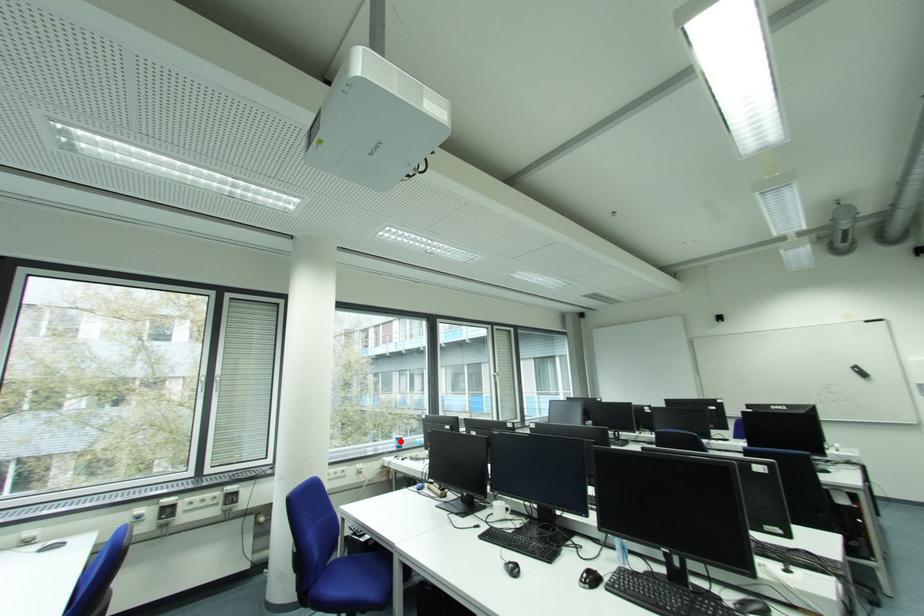
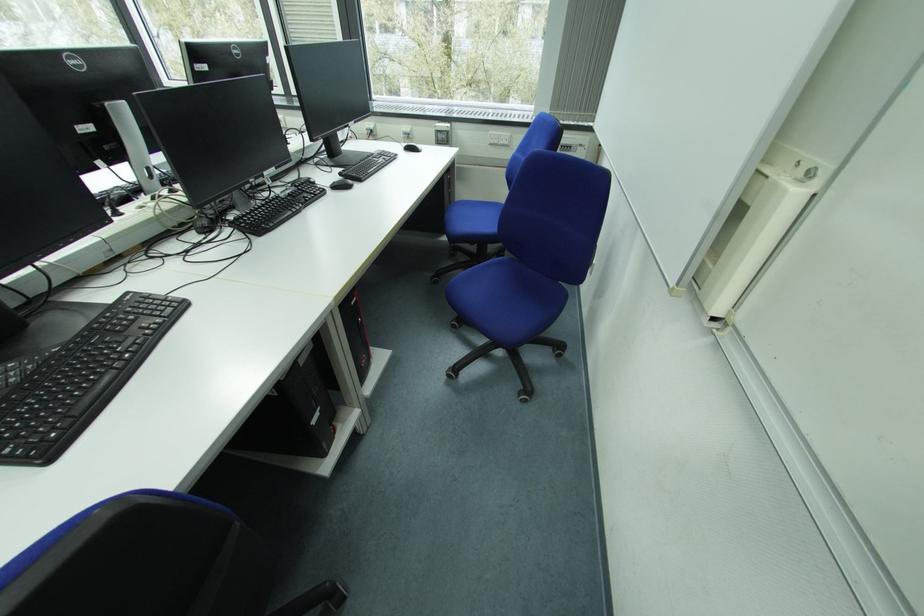
Question: I am providing you with two images of the same scene from different viewpoints. A red point is marked on the first image. At the location where the point appears in image 1, is it still visible in image 2?

Choices:
 (A) Yes
 (B) No

Answer: (B)